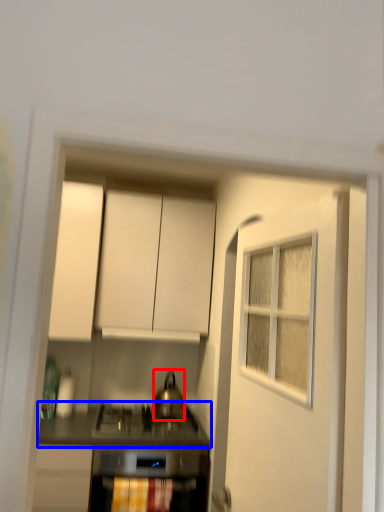
Question: Which object is closer to the camera taking this photo, kitchen appliance (highlighted by a red box) or countertop (highlighted by a blue box)?

Choices:
 (A) kitchen appliance
 (B) countertop

Answer: (B)